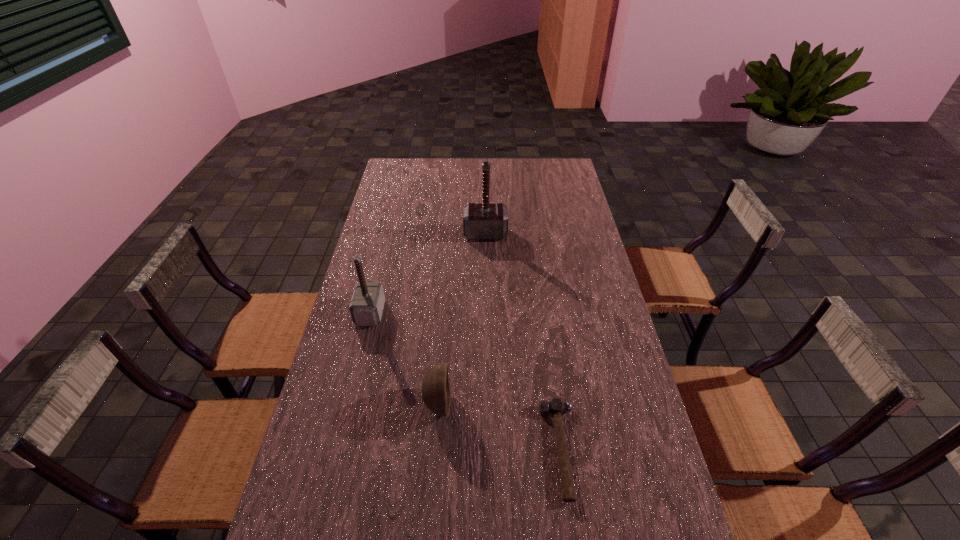
Where is `free space between the third object from right to left and the nearest hammer`? The image size is (960, 540). free space between the third object from right to left and the nearest hammer is located at coordinates (499, 427).

Where is `empty location between the farthest object and the bowl`? Image resolution: width=960 pixels, height=540 pixels. empty location between the farthest object and the bowl is located at coordinates (462, 319).

Locate an element on the screen. The width and height of the screenshot is (960, 540). vacant space in between the second hammer from right to left and the bowl is located at coordinates (462, 319).

What are the coordinates of `unoccupied area between the tallest hammer and the second shortest hammer` in the screenshot? It's located at (428, 273).

This screenshot has height=540, width=960. I want to click on unoccupied area between the second tallest hammer and the tallest object, so click(428, 273).

In order to click on vacant area between the second farthest hammer and the shortest object in this screenshot , I will do `click(466, 381)`.

This screenshot has height=540, width=960. Identify the location of vacant area that lies between the bowl and the second nearest hammer. (404, 358).

This screenshot has width=960, height=540. Identify the location of free space that is in between the farthest object and the bowl. (462, 319).

Where is `object that is the second nearest to the nearest hammer`? The height and width of the screenshot is (540, 960). object that is the second nearest to the nearest hammer is located at coordinates (366, 307).

Identify the location of object that is the second closest to the second hammer from right to left. (436, 392).